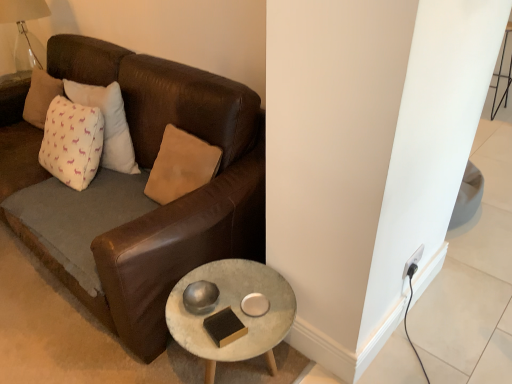
Describe the element at coordinates (234, 312) in the screenshot. I see `metallic marble coffee table at lower right` at that location.

You are a GUI agent. You are given a task and a screenshot of the screen. Output one action in this format:
    pyautogui.click(x=<x>, y=<y>)
    Task: Click on the metallic marble coffee table at lower right
    
    Given the screenshot: What is the action you would take?
    pyautogui.click(x=234, y=312)

The width and height of the screenshot is (512, 384). In order to click on metallic marble coffee table at lower right in this screenshot , I will do tap(234, 312).